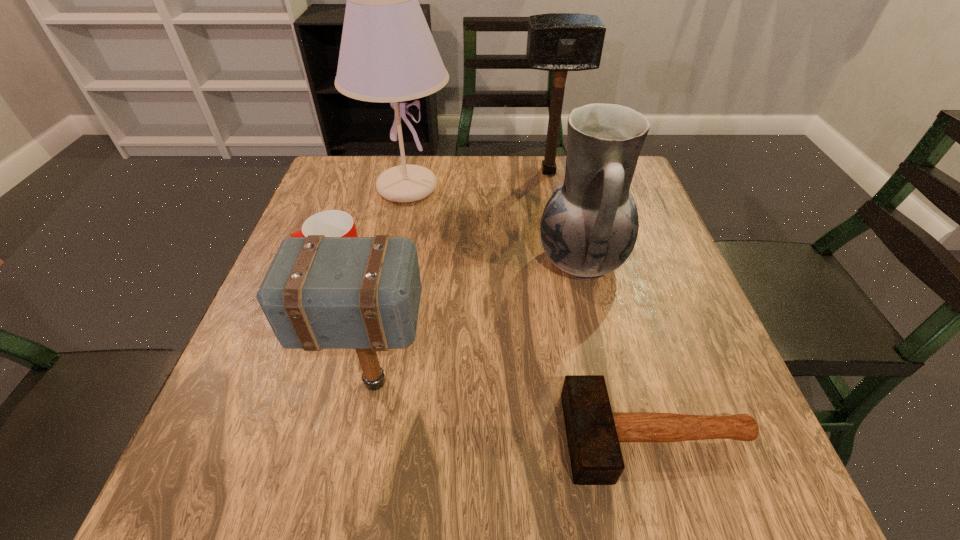
This screenshot has height=540, width=960. I want to click on mallet present at the left edge, so click(363, 293).

Locate an element on the screen. Image resolution: width=960 pixels, height=540 pixels. cup at the left edge is located at coordinates (332, 223).

Image resolution: width=960 pixels, height=540 pixels. Identify the location of pitcher that is at the right edge. (589, 227).

Identify the location of object situated at the far left corner. (387, 54).

Identify the location of object that is at the far right corner. Image resolution: width=960 pixels, height=540 pixels. (560, 42).

Find the location of `object that is at the near right corner`. object that is at the near right corner is located at coordinates (593, 432).

In the image, there is a desktop. Where is `vacant area at the far edge`? vacant area at the far edge is located at coordinates (539, 199).

Identify the location of vacant space at the near edge. point(541,488).

The width and height of the screenshot is (960, 540). What are the coordinates of `vacant space at the left edge of the desktop` in the screenshot? It's located at tap(227, 392).

Find the location of a particular element. The height and width of the screenshot is (540, 960). vacant space at the right edge of the desktop is located at coordinates (681, 292).